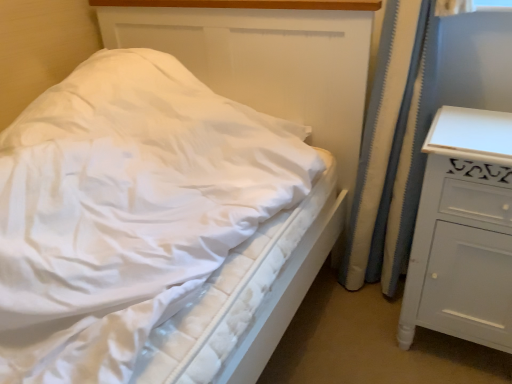
Question: Considering the positions of white painted wood chest of drawers at right and white textured curtain at right in the image, is white painted wood chest of drawers at right wider or thinner than white textured curtain at right?

Choices:
 (A) wide
 (B) thin

Answer: (A)

Question: From the image's perspective, relative to white textured curtain at right, is white painted wood chest of drawers at right above or below?

Choices:
 (A) below
 (B) above

Answer: (A)

Question: Which object is positioned farthest from the white textured curtain at right?

Choices:
 (A) white quilted mattress at center
 (B) white painted wood chest of drawers at right

Answer: (A)

Question: Which of these objects is positioned closest to the white painted wood chest of drawers at right?

Choices:
 (A) white textured curtain at right
 (B) white quilted mattress at center

Answer: (A)